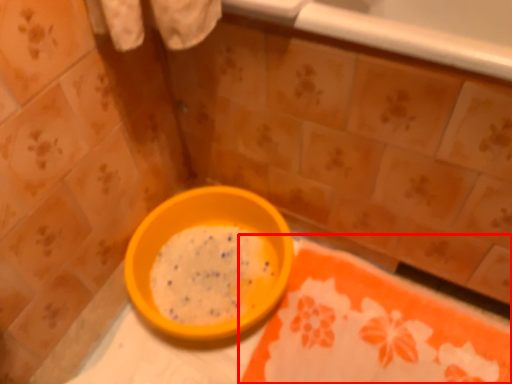
Question: Considering the relative positions of tablecloth (annotated by the red box) and bowl in the image provided, where is tablecloth (annotated by the red box) located with respect to the staircase?

Choices:
 (A) right
 (B) left

Answer: (A)